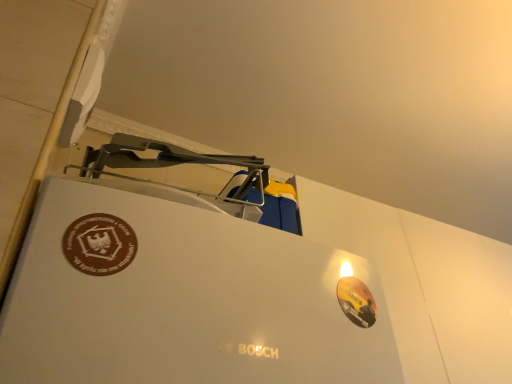
Question: Is glossy orange sticker at lower right, which is counted as the first logo, starting from the right, wider than brown matte sticker at upper left, placed as the 2th logo when sorted from right to left?

Choices:
 (A) no
 (B) yes

Answer: (B)

Question: Are glossy orange sticker at lower right, the second logo viewed from the top, and brown matte sticker at upper left, which ranks as the first logo in top-to-bottom order, far apart?

Choices:
 (A) yes
 (B) no

Answer: (B)

Question: From the image's perspective, is glossy orange sticker at lower right, positioned as the first logo in back-to-front order, located beneath brown matte sticker at upper left, placed as the 2th logo when sorted from right to left?

Choices:
 (A) no
 (B) yes

Answer: (B)

Question: From a real-world perspective, is glossy orange sticker at lower right, the second logo viewed from the top, on top of brown matte sticker at upper left, which appears as the 1th logo when viewed from the front?

Choices:
 (A) no
 (B) yes

Answer: (A)

Question: Is glossy orange sticker at lower right, which is counted as the first logo, starting from the right, positioned in front of brown matte sticker at upper left, which appears as the 1th logo when viewed from the front?

Choices:
 (A) no
 (B) yes

Answer: (A)

Question: From the image's perspective, is glossy orange sticker at lower right, the 1th logo in the bottom-to-top sequence, located above brown matte sticker at upper left, the second logo from the back?

Choices:
 (A) yes
 (B) no

Answer: (B)

Question: Considering the relative positions of brown matte sticker at upper left, which appears as the 1th logo when viewed from the front, and glossy orange sticker at lower right, the 1th logo in the bottom-to-top sequence, in the image provided, is brown matte sticker at upper left, which appears as the 1th logo when viewed from the front, to the left of glossy orange sticker at lower right, the 1th logo in the bottom-to-top sequence, from the viewer's perspective?

Choices:
 (A) yes
 (B) no

Answer: (A)

Question: Would you say glossy orange sticker at lower right, the second logo viewed from the top, is part of brown matte sticker at upper left, the 2th logo when ordered from bottom to top,'s contents?

Choices:
 (A) no
 (B) yes

Answer: (A)

Question: Does brown matte sticker at upper left, which ranks as the first logo in top-to-bottom order, touch glossy orange sticker at lower right, the second logo viewed from the front?

Choices:
 (A) yes
 (B) no

Answer: (B)

Question: Is brown matte sticker at upper left, which ranks as the first logo in top-to-bottom order, closer to camera compared to glossy orange sticker at lower right, the 1th logo in the bottom-to-top sequence?

Choices:
 (A) no
 (B) yes

Answer: (B)

Question: Can you confirm if brown matte sticker at upper left, the second logo from the back, is shorter than glossy orange sticker at lower right, the second logo viewed from the top?

Choices:
 (A) no
 (B) yes

Answer: (A)

Question: Is brown matte sticker at upper left, the second logo from the back, positioned with its back to glossy orange sticker at lower right, positioned as the first logo in back-to-front order?

Choices:
 (A) no
 (B) yes

Answer: (A)

Question: From the image's perspective, relative to glossy orange sticker at lower right, the second logo viewed from the top, is brown matte sticker at upper left, the 2th logo when ordered from bottom to top, above or below?

Choices:
 (A) above
 (B) below

Answer: (A)